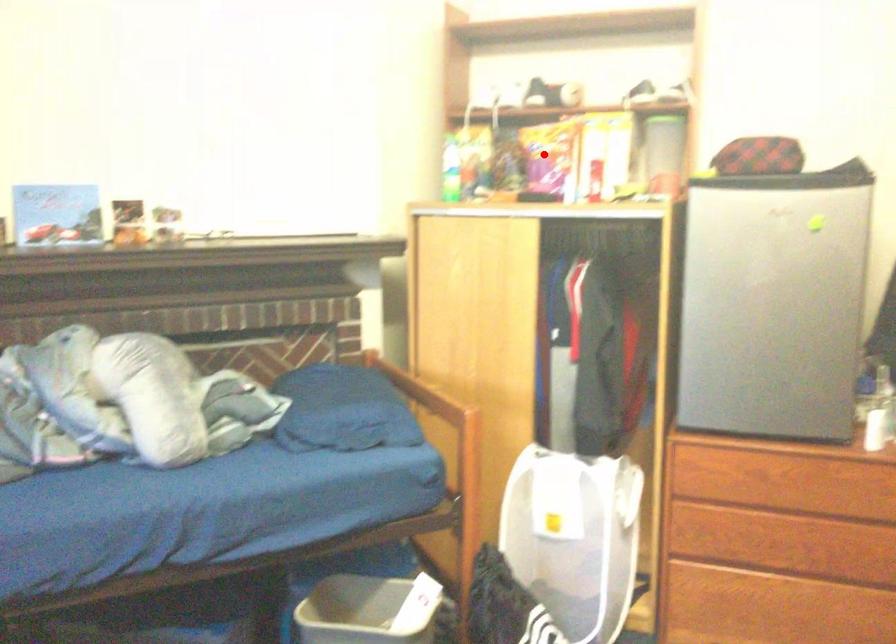
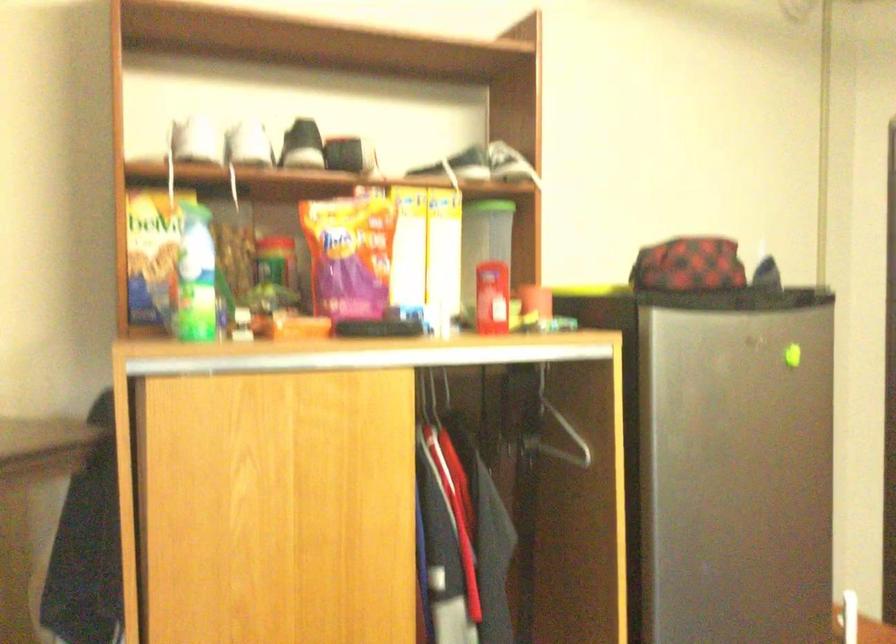
The point at the highlighted location is marked in the first image. Where is the corresponding point in the second image?

(349, 254)